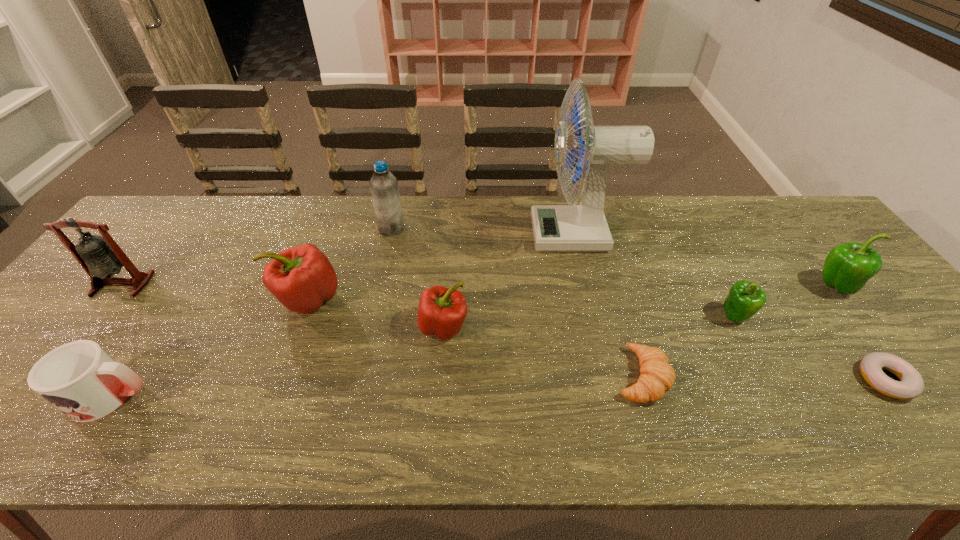
Select which bell pepper appears as the third closest to the second bell pepper from left to right. Please provide its 2D coordinates. Your answer should be formatted as a tuple, i.e. [(x, y)], where the tuple contains the x and y coordinates of a point satisfying the conditions above.

[(848, 267)]

This screenshot has width=960, height=540. In order to click on vacant point that satisfies the following two spatial constraints: 1. on the front side of the brown doughnut; 2. on the left side of the eighth object from right to left in this screenshot , I will do `click(277, 380)`.

At what (x,y) coordinates should I click in order to perform the action: click on vacant position in the image that satisfies the following two spatial constraints: 1. on the front side of the brown doughnut; 2. on the right side of the leftmost object. Please return your answer as a coordinate pair (x, y). The image size is (960, 540). Looking at the image, I should click on (46, 380).

Where is `blank area in the image that satisfies the following two spatial constraints: 1. on the back side of the rightmost bell pepper; 2. on the right side of the crescent roll`? blank area in the image that satisfies the following two spatial constraints: 1. on the back side of the rightmost bell pepper; 2. on the right side of the crescent roll is located at coordinates (614, 287).

The width and height of the screenshot is (960, 540). What are the coordinates of `blank space that satisfies the following two spatial constraints: 1. on the front-facing side of the tallest object; 2. on the left side of the bigger green bell pepper` in the screenshot? It's located at (589, 287).